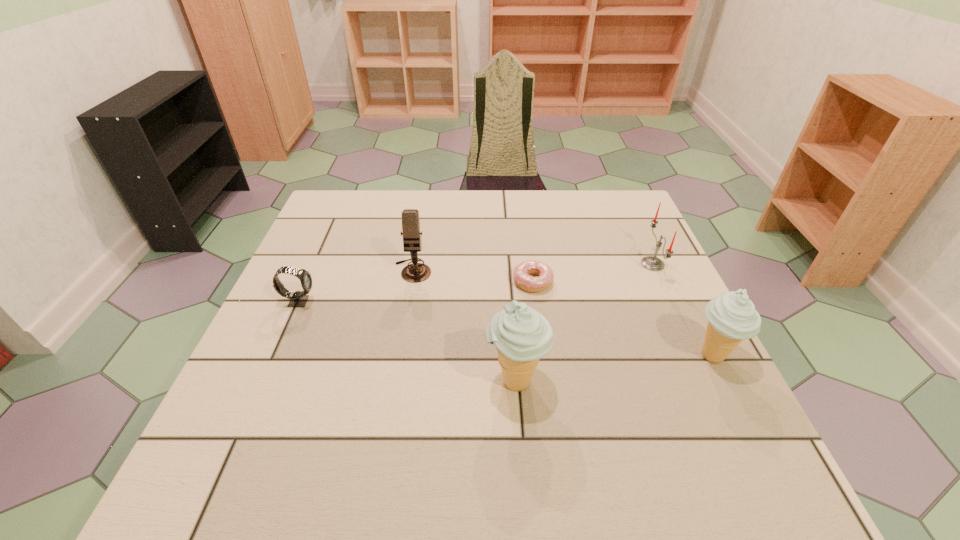
I want to click on vacant space at the far edge of the desktop, so click(506, 234).

At what (x,y) coordinates should I click in order to perform the action: click on vacant space at the left edge. Please return your answer as a coordinate pair (x, y). The image size is (960, 540). Looking at the image, I should click on (341, 318).

Locate an element on the screen. The width and height of the screenshot is (960, 540). free region at the right edge of the desktop is located at coordinates (636, 269).

Identify the location of vacant area at the near left corner. (252, 429).

You are a GUI agent. You are given a task and a screenshot of the screen. Output one action in this format:
    pyautogui.click(x=<x>, y=<y>)
    Task: Click on the free space between the taller icecream and the fifth tallest object
    The width and height of the screenshot is (960, 540).
    Given the screenshot: What is the action you would take?
    pyautogui.click(x=408, y=341)

Locate an element on the screen. The width and height of the screenshot is (960, 540). vacant region between the third shortest object and the shorter icecream is located at coordinates (683, 310).

Locate an element on the screen. This screenshot has height=540, width=960. free space that is in between the third shortest object and the shorter icecream is located at coordinates (683, 310).

This screenshot has height=540, width=960. I want to click on empty location between the fifth tallest object and the doughnut, so click(416, 292).

Where is `free spot between the shorter icecream and the candle`? The image size is (960, 540). free spot between the shorter icecream and the candle is located at coordinates (683, 310).

The image size is (960, 540). What are the coordinates of `vacant area between the shortest object and the second shortest object` in the screenshot? It's located at (416, 292).